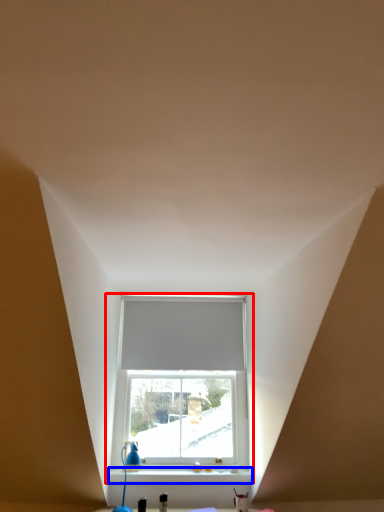
Question: Which of the following is the farthest to the observer, window (highlighted by a red box) or window sill (highlighted by a blue box)?

Choices:
 (A) window
 (B) window sill

Answer: (A)